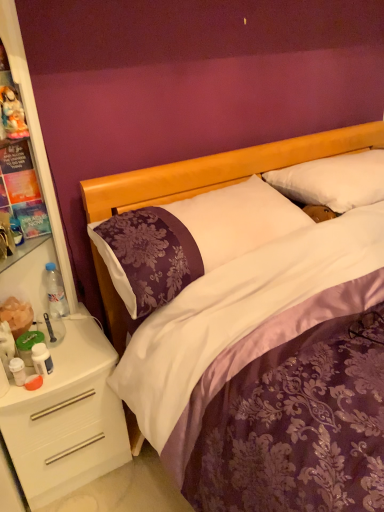
Find the location of `empty space that is ontop of white plastic drawer at lower left (from a real-world perspective)`. empty space that is ontop of white plastic drawer at lower left (from a real-world perspective) is located at coordinates (56, 354).